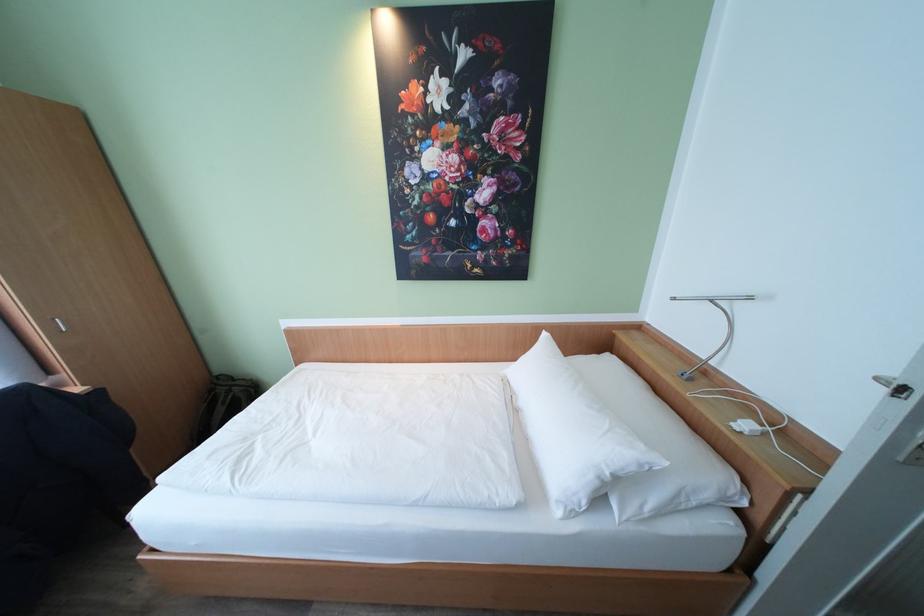
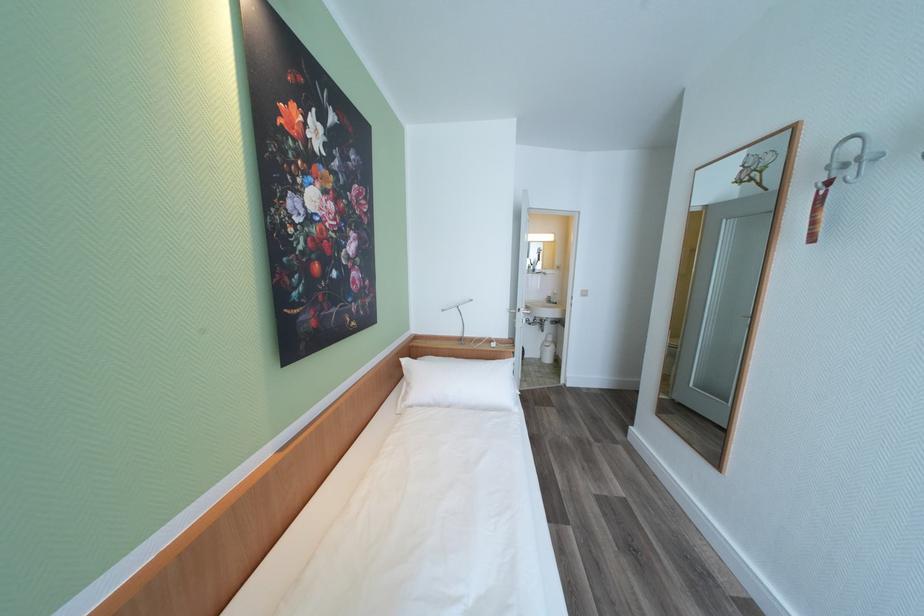
Where in the second image is the point corresponding to (553,336) from the first image?

(411, 362)